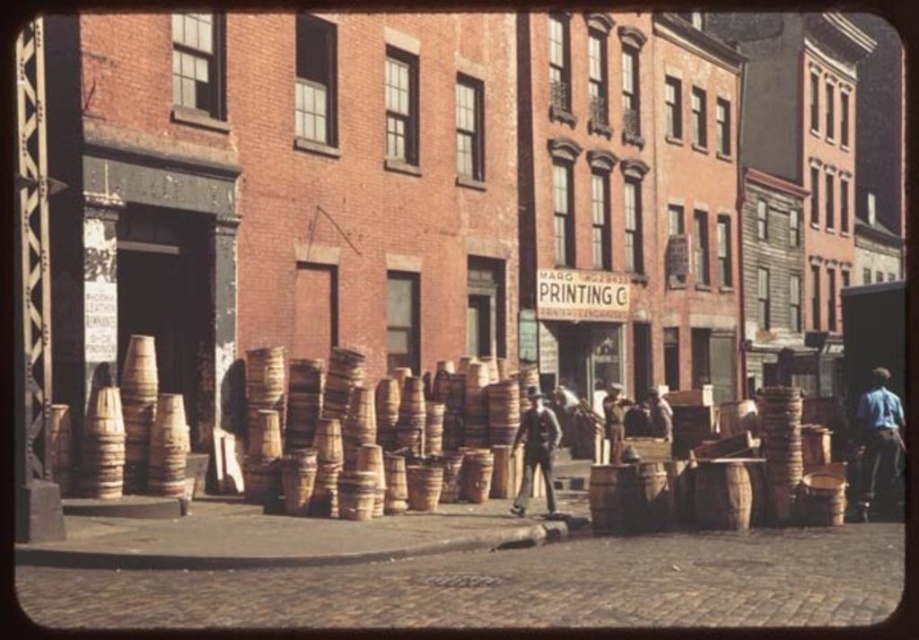
You are a tailor observing a street scene and notice two individuals dressed in a blue denim shirt at right and a dark brown leather coat at center. Which person is taller?

The blue denim shirt at right is taller than the dark brown leather coat at center, so the person wearing the blue denim shirt at right is taller.

You are standing on the street and see two points marked in the scene. Which point is closer to you, point (512, 380) or point (886, 448)?

Point (512, 380) is closer to you than point (886, 448).

You are a delivery person standing on the street and see both the wooden barrel at center and the dark brown leather coat at center. Which object is positioned higher from the ground?

The wooden barrel at center is above the dark brown leather coat at center, so it is positioned higher from the ground.